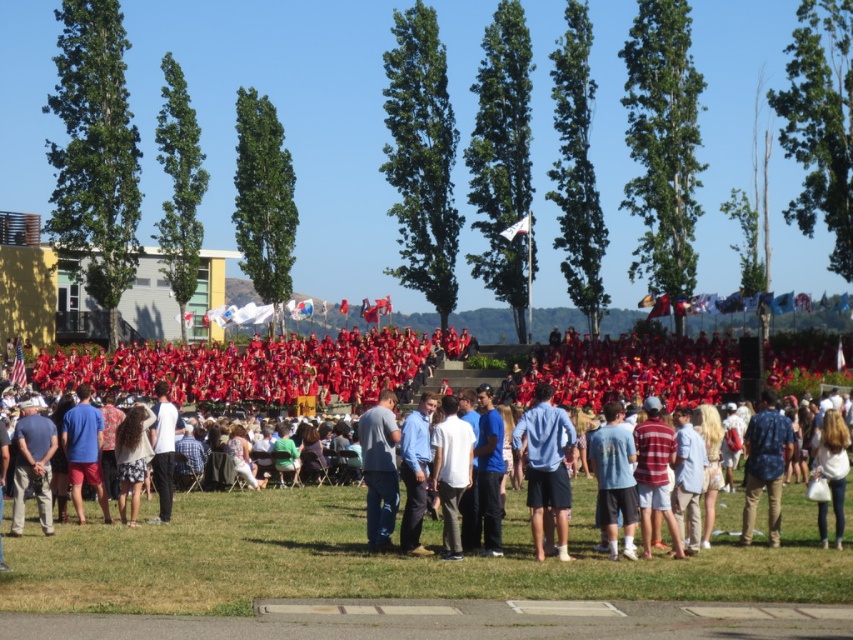
Question: Which point appears closest to the camera in this image?

Choices:
 (A) (154, 445)
 (B) (606, 419)
 (C) (540, 470)

Answer: (C)

Question: Which point is closer to the camera taking this photo?

Choices:
 (A) (158, 486)
 (B) (537, 424)

Answer: (B)

Question: Which is nearer to the blue jeans at center?

Choices:
 (A) blue denim jeans at lower left
 (B) white matte shirt at center
 (C) denim shorts at lower left

Answer: (B)

Question: Can you confirm if blue denim jeans at lower left is positioned to the right of white matte shirt at center?

Choices:
 (A) yes
 (B) no

Answer: (B)

Question: Can you confirm if light blue denim shorts at center is positioned to the left of denim shorts at lower left?

Choices:
 (A) yes
 (B) no

Answer: (B)

Question: Is white matte shirt at center positioned in front of denim shorts at lower left?

Choices:
 (A) yes
 (B) no

Answer: (B)